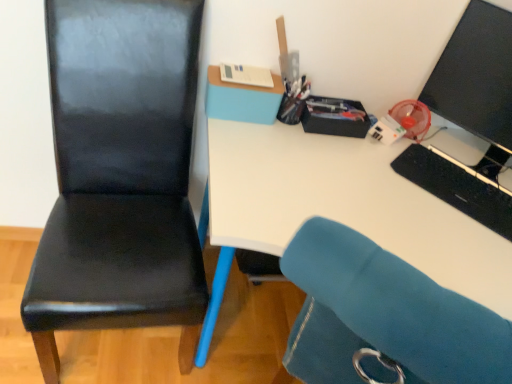
In order to click on black glossy monitor at upper right in this screenshot , I will do `click(477, 81)`.

Identify the location of white paper at upper center, the 1th stationery viewed from the left. The width and height of the screenshot is (512, 384). (x=246, y=75).

Describe the element at coordinates (335, 117) in the screenshot. I see `matte black stationery box at upper right, which is the first stationery in right-to-left order` at that location.

Identify the location of white glossy desk at upper center. Image resolution: width=512 pixels, height=384 pixels. (346, 204).

Based on the photo, considering the relative sizes of black glossy monitor at upper right and metallic pen holder at upper center, acting as the 2th stationery starting from the right, in the image provided, is black glossy monitor at upper right taller than metallic pen holder at upper center, acting as the 2th stationery starting from the right,?

Yes, black glossy monitor at upper right is taller than metallic pen holder at upper center, acting as the 2th stationery starting from the right.

Is black glossy monitor at upper right inside or outside of metallic pen holder at upper center, which appears as the 2th stationery when viewed from the left?

black glossy monitor at upper right is located beyond the bounds of metallic pen holder at upper center, which appears as the 2th stationery when viewed from the left.

Is black glossy monitor at upper right far from metallic pen holder at upper center, which appears as the 2th stationery when viewed from the left?

No, black glossy monitor at upper right is not far from metallic pen holder at upper center, which appears as the 2th stationery when viewed from the left.

Can you tell me how much black glossy monitor at upper right and metallic pen holder at upper center, which appears as the 2th stationery when viewed from the left, differ in facing direction?

The angular difference between black glossy monitor at upper right and metallic pen holder at upper center, which appears as the 2th stationery when viewed from the left, is 49.1 degrees.

From the image's perspective, is white glossy desk at upper center positioned above or below metallic pen holder at upper center, acting as the 2th stationery starting from the right?

From the image's perspective, white glossy desk at upper center appears below metallic pen holder at upper center, acting as the 2th stationery starting from the right.

Is white glossy desk at upper center facing away from metallic pen holder at upper center, which appears as the 2th stationery when viewed from the left?

That's not correct — white glossy desk at upper center is not looking away from metallic pen holder at upper center, which appears as the 2th stationery when viewed from the left.

Can you confirm if white glossy desk at upper center is wider than metallic pen holder at upper center, which appears as the 2th stationery when viewed from the left?

Indeed, white glossy desk at upper center has a greater width compared to metallic pen holder at upper center, which appears as the 2th stationery when viewed from the left.

How many degrees apart are the facing directions of white glossy desk at upper center and metallic pen holder at upper center, acting as the 2th stationery starting from the right?

There is a 136-degree angle between the facing directions of white glossy desk at upper center and metallic pen holder at upper center, acting as the 2th stationery starting from the right.

Is matte black stationery box at upper right, which is the first stationery in right-to-left order, to the right of white glossy desk at upper center from the viewer's perspective?

Incorrect, matte black stationery box at upper right, which is the first stationery in right-to-left order, is not on the right side of white glossy desk at upper center.

Is matte black stationery box at upper right, the third stationery from the left, turned away from white glossy desk at upper center?

No, matte black stationery box at upper right, the third stationery from the left,'s orientation is not away from white glossy desk at upper center.

From a real-world perspective, between matte black stationery box at upper right, the third stationery from the left, and white glossy desk at upper center, who is vertically lower?

white glossy desk at upper center.

Considering their positions, is matte black stationery box at upper right, which is the first stationery in right-to-left order, located in front of or behind white glossy desk at upper center?

Visually, matte black stationery box at upper right, which is the first stationery in right-to-left order, is located behind white glossy desk at upper center.

Would you say white paper at upper center, the 3th stationery from the right, is a long distance from matte black stationery box at upper right, which is the first stationery in right-to-left order?

white paper at upper center, the 3th stationery from the right, is actually quite close to matte black stationery box at upper right, which is the first stationery in right-to-left order.

Based on the photo, can you confirm if white paper at upper center, the 1th stationery viewed from the left, is shorter than matte black stationery box at upper right, the third stationery from the left?

Indeed, white paper at upper center, the 1th stationery viewed from the left, has a lesser height compared to matte black stationery box at upper right, the third stationery from the left.

Is white paper at upper center, the 1th stationery viewed from the left, in front of matte black stationery box at upper right, which is the first stationery in right-to-left order?

Yes, it is.

How many degrees apart are the facing directions of white paper at upper center, the 3th stationery from the right, and matte black stationery box at upper right, the third stationery from the left?

The facing directions of white paper at upper center, the 3th stationery from the right, and matte black stationery box at upper right, the third stationery from the left, are 1.7 degrees apart.

Measure the distance from black matte keyboard at right to black leather chair at left.

black matte keyboard at right is 33.52 inches away from black leather chair at left.

I want to click on keyboard above the black leather chair at left (from the image's perspective), so tap(456, 188).

Is the position of black matte keyboard at right less distant than that of black leather chair at left?

No.

From a real-world perspective, between black matte keyboard at right and black leather chair at left, who is vertically lower?

black leather chair at left is physically lower.

Is matte black stationery box at upper right, which is the first stationery in right-to-left order, outside of black matte keyboard at right?

Yes, matte black stationery box at upper right, which is the first stationery in right-to-left order, is located beyond the bounds of black matte keyboard at right.

Is matte black stationery box at upper right, the third stationery from the left, bigger than black matte keyboard at right?

No.

Considering the sizes of objects matte black stationery box at upper right, the third stationery from the left, and black matte keyboard at right in the image provided, who is shorter, matte black stationery box at upper right, the third stationery from the left, or black matte keyboard at right?

black matte keyboard at right is shorter.

Would you say black leather chair at left is inside or outside metallic pen holder at upper center, acting as the 2th stationery starting from the right?

black leather chair at left lies outside metallic pen holder at upper center, acting as the 2th stationery starting from the right.

From the image's perspective, is black leather chair at left above or below metallic pen holder at upper center, acting as the 2th stationery starting from the right?

Based on their image positions, black leather chair at left is located beneath metallic pen holder at upper center, acting as the 2th stationery starting from the right.

Identify the location of the 2nd stationery above when counting from the black leather chair at left (from the image's perspective). (293, 100).

Where is `computer monitor located above the metallic pen holder at upper center, acting as the 2th stationery starting from the right (from the image's perspective)`? computer monitor located above the metallic pen holder at upper center, acting as the 2th stationery starting from the right (from the image's perspective) is located at coordinates (477, 81).

Find the location of a particular element. This screenshot has height=384, width=512. desk in front of the metallic pen holder at upper center, acting as the 2th stationery starting from the right is located at coordinates (346, 204).

Estimate the real-world distances between objects in this image. Which object is closer to matte black stationery box at upper right, the third stationery from the left, white glossy desk at upper center or black leather chair at left?

white glossy desk at upper center.

Considering their positions, is white paper at upper center, the 1th stationery viewed from the left, positioned closer to black glossy monitor at upper right than matte black stationery box at upper right, which is the first stationery in right-to-left order?

matte black stationery box at upper right, which is the first stationery in right-to-left order, is closer to black glossy monitor at upper right.

Based on their spatial positions, is metallic pen holder at upper center, acting as the 2th stationery starting from the right, or black glossy monitor at upper right further from black leather chair at left?

black glossy monitor at upper right lies further to black leather chair at left than the other object.

From the image, which object appears to be farther from white paper at upper center, the 3th stationery from the right, black matte keyboard at right or black glossy monitor at upper right?

Among the two, black matte keyboard at right is located further to white paper at upper center, the 3th stationery from the right.

From the image, which object appears to be farther from metallic pen holder at upper center, which appears as the 2th stationery when viewed from the left, black leather chair at left or matte black stationery box at upper right, the third stationery from the left?

Based on the image, black leather chair at left appears to be further to metallic pen holder at upper center, which appears as the 2th stationery when viewed from the left.

From the image, which object appears to be nearer to black matte keyboard at right, black leather chair at left or metallic pen holder at upper center, which appears as the 2th stationery when viewed from the left?

metallic pen holder at upper center, which appears as the 2th stationery when viewed from the left, lies closer to black matte keyboard at right than the other object.

From the image, which object appears to be farther from white paper at upper center, the 1th stationery viewed from the left, black glossy monitor at upper right or black matte keyboard at right?

black matte keyboard at right.

Based on their spatial positions, is black leather chair at left or matte black stationery box at upper right, the third stationery from the left, further from white paper at upper center, the 3th stationery from the right?

black leather chair at left.

The image size is (512, 384). I want to click on stationery situated between metallic pen holder at upper center, which appears as the 2th stationery when viewed from the left, and black matte keyboard at right from left to right, so click(335, 117).

Locate an element on the screen. Image resolution: width=512 pixels, height=384 pixels. keyboard between white glossy desk at upper center and metallic pen holder at upper center, acting as the 2th stationery starting from the right, in the front-back direction is located at coordinates (456, 188).

Where is `chair positioned between white glossy desk at upper center and white paper at upper center, the 3th stationery from the right, from near to far`? The height and width of the screenshot is (384, 512). chair positioned between white glossy desk at upper center and white paper at upper center, the 3th stationery from the right, from near to far is located at coordinates (119, 175).

Locate an element on the screen. The width and height of the screenshot is (512, 384). computer monitor positioned between white glossy desk at upper center and black matte keyboard at right from near to far is located at coordinates point(477,81).